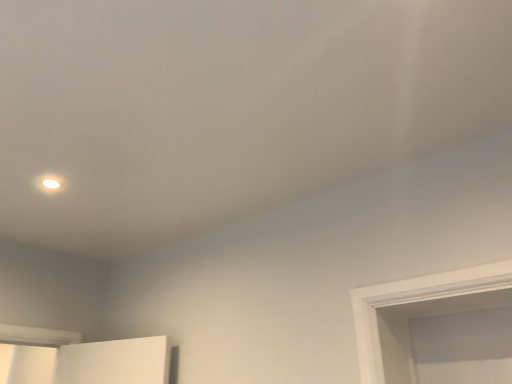
Describe the element at coordinates (51, 183) in the screenshot. I see `white glossy light fixture at upper left` at that location.

In the scene shown: What is the approximate height of white glossy light fixture at upper left?

white glossy light fixture at upper left is 0.47 inches in height.

Locate an element on the screen. The image size is (512, 384). white glossy light fixture at upper left is located at coordinates (51, 183).

Locate an element on the screen. This screenshot has width=512, height=384. white glossy light fixture at upper left is located at coordinates (51, 183).